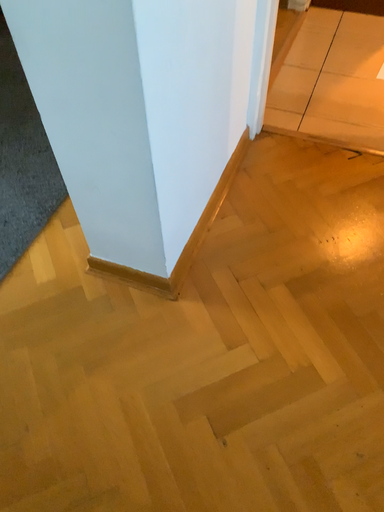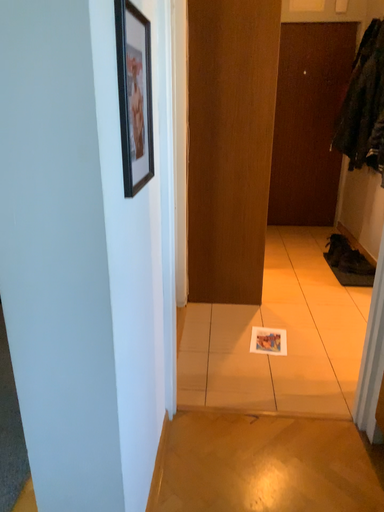
Question: How did the camera likely rotate when shooting the video?

Choices:
 (A) rotated downward
 (B) rotated upward

Answer: (B)